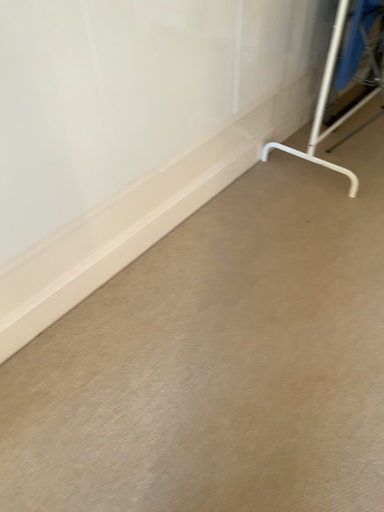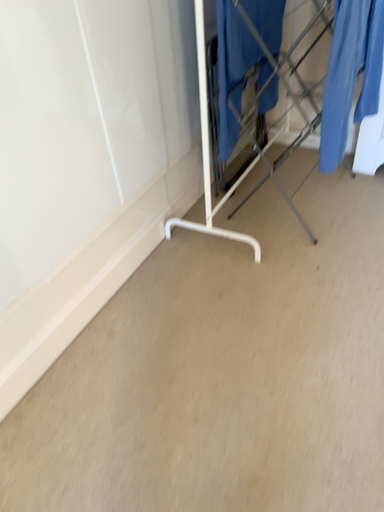
Question: How did the camera likely rotate when shooting the video?

Choices:
 (A) rotated downward
 (B) rotated upward

Answer: (B)